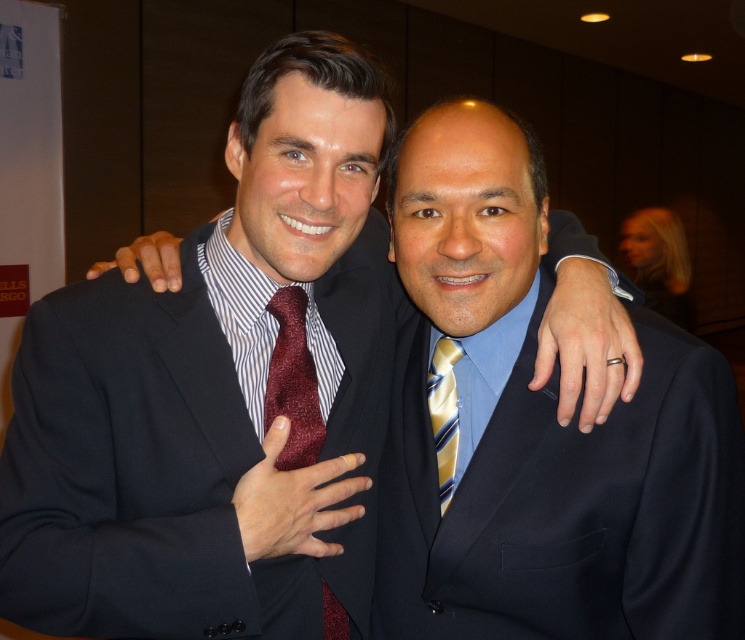
Which is behind, point (130, 448) or point (305, 413)?

Point (305, 413)

Does point (142, 552) lie in front of point (264, 406)?

Yes, point (142, 552) is closer to viewer.

Locate an element on the screen. matte black suit at left is located at coordinates (145, 477).

Consider the image. Does matte black suit at left appear on the left side of yellow striped tie at center?

Yes, matte black suit at left is to the left of yellow striped tie at center.

Who is more distant from viewer, (142, 488) or (457, 349)?

Point (457, 349)

At what (x,y) coordinates should I click in order to perform the action: click on matte black suit at left. Please return your answer as a coordinate pair (x, y). This screenshot has width=745, height=640. Looking at the image, I should click on (145, 477).

Between matte black suit at center and maroon textured tie at center, which one is positioned higher?

Positioned higher is matte black suit at center.

Can you confirm if matte black suit at center is smaller than maroon textured tie at center?

No, matte black suit at center is not smaller than maroon textured tie at center.

Does point (679, 460) come in front of point (332, 621)?

Yes, point (679, 460) is in front of point (332, 621).

Locate an element on the screen. matte black suit at center is located at coordinates (567, 499).